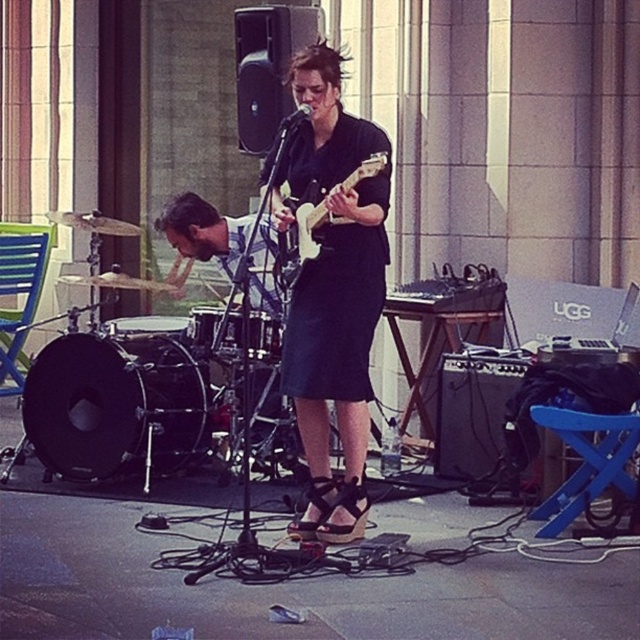
The height and width of the screenshot is (640, 640). What do you see at coordinates (312, 227) in the screenshot?
I see `white glossy electric guitar at center` at bounding box center [312, 227].

Who is more distant from viewer, (371, 157) or (308, 106)?

Point (308, 106)

Which is in front, point (365, 166) or point (298, 116)?

Positioned in front is point (365, 166).

Find the location of a particular element. This screenshot has height=640, width=640. white glossy electric guitar at center is located at coordinates (312, 227).

The image size is (640, 640). I want to click on matte black guitar at center, so click(x=332, y=291).

Can you confirm if matte black guitar at center is positioned below white glossy electric guitar at center?

Indeed, matte black guitar at center is positioned under white glossy electric guitar at center.

Which is in front, point (324, 436) or point (378, 170)?

Point (378, 170) is in front.

You are a GUI agent. You are given a task and a screenshot of the screen. Output one action in this format:
    pyautogui.click(x=<x>, y=<y>)
    Task: Click on the matte black guitar at center
    
    Given the screenshot: What is the action you would take?
    pyautogui.click(x=332, y=291)

Can you confirm if matte black guitar at center is positioned below black matte microphone at center?

Correct, matte black guitar at center is located below black matte microphone at center.

From the picture: Is matte black guitar at center wider than black matte microphone at center?

Yes, matte black guitar at center is wider than black matte microphone at center.

The image size is (640, 640). I want to click on matte black guitar at center, so click(x=332, y=291).